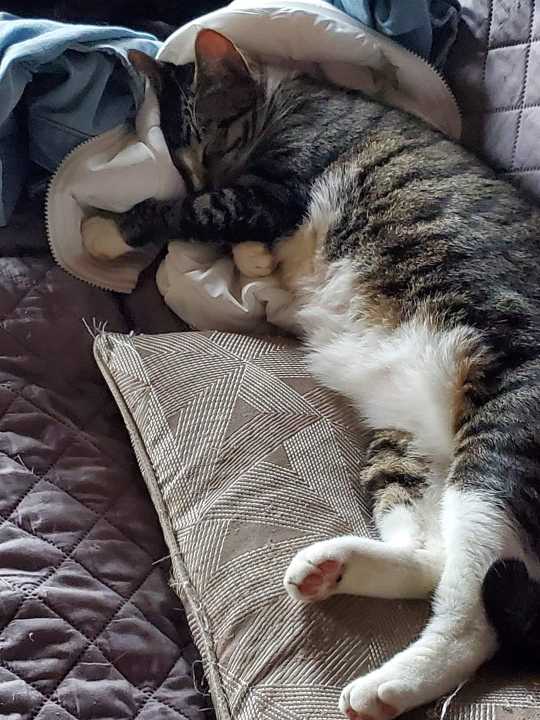
Image resolution: width=540 pixels, height=720 pixels. Identify the location of pillow. (240, 482), (503, 708).